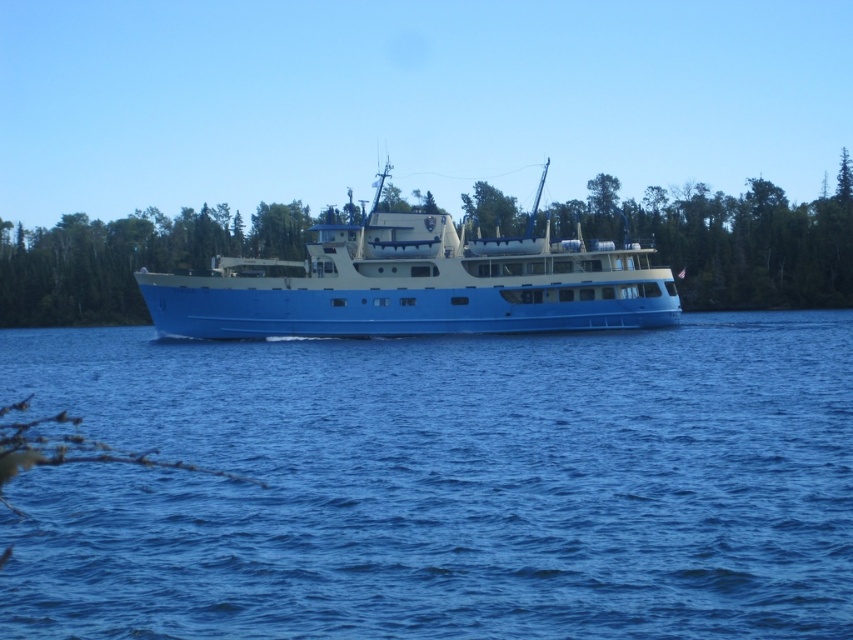
You are standing on the deck of the blue matte boat at center. Looking down, you see the blue liquid water at center. Which object is closer to you?

The blue matte boat at center is closer to you since you are standing on it, while the blue liquid water at center is below it.

You are standing on the deck of the large blue and beige ship and want to take a photo of the point at coordinates point [596,477]. If your camera has a maximum range of 25 meters, will you be able to capture the point in your photo?

The point [596,477] is 24.40 meters away from the camera, which is within the 25 meter range. Therefore, the camera can capture the point in the photo.